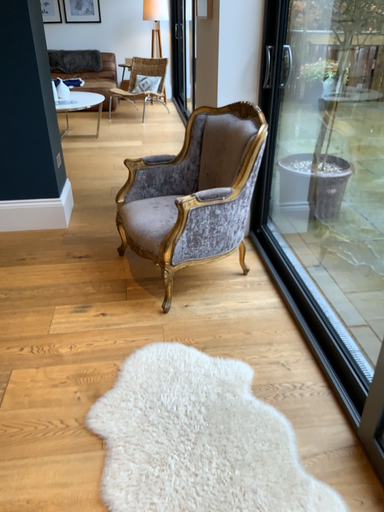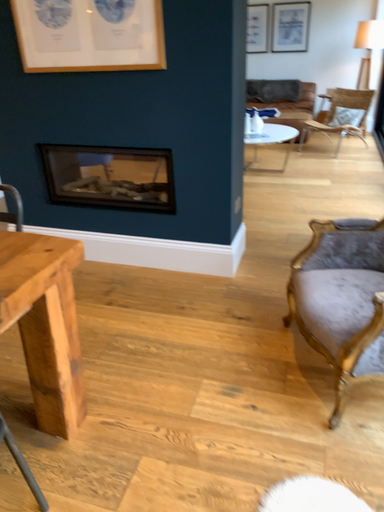
Question: How did the camera likely rotate when shooting the video?

Choices:
 (A) rotated left
 (B) rotated right

Answer: (A)